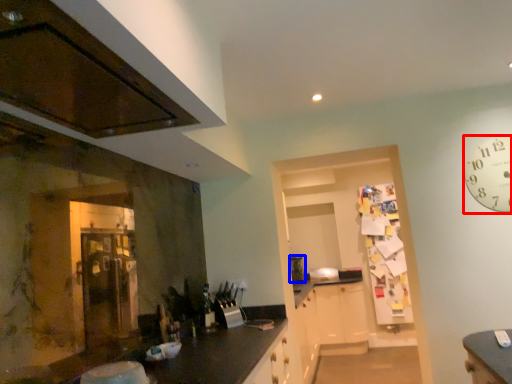
Question: Which object appears farthest to the camera in this image, clock (highlighted by a red box) or appliance (highlighted by a blue box)?

Choices:
 (A) clock
 (B) appliance

Answer: (B)